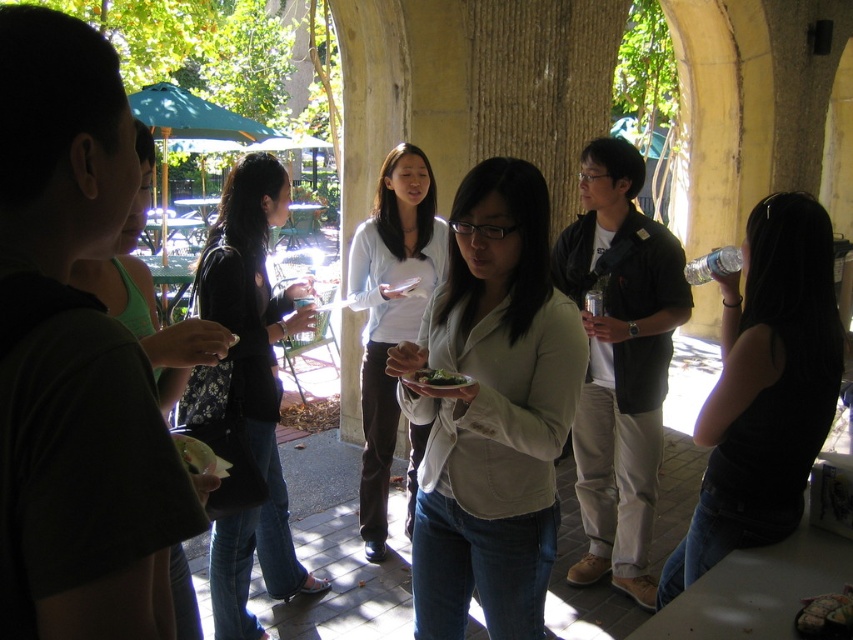
Question: Among these points, which one is nearest to the camera?

Choices:
 (A) (234, 573)
 (B) (780, 280)
 (C) (425, 339)
 (D) (383, 496)

Answer: (B)

Question: Is matte black shirt at left smaller than green leafy salad at center?

Choices:
 (A) no
 (B) yes

Answer: (A)

Question: Considering the relative positions of matte black shirt at left and green leafy salad at center in the image provided, where is matte black shirt at left located with respect to green leafy salad at center?

Choices:
 (A) above
 (B) below

Answer: (A)

Question: Which point is closer to the camera taking this photo?

Choices:
 (A) (512, 234)
 (B) (347, 266)

Answer: (A)

Question: Based on their relative distances, which object is farther from the light beige shirt at center?

Choices:
 (A) white matte shirt at center
 (B) green leafy salad at center

Answer: (A)

Question: Does light beige shirt at center come in front of white matte shirt at center?

Choices:
 (A) yes
 (B) no

Answer: (A)